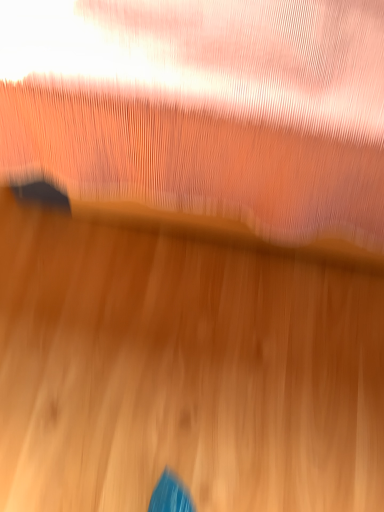
Question: Are pink sheer curtain at upper center and wooden floor at center located far from each other?

Choices:
 (A) no
 (B) yes

Answer: (A)

Question: Is the depth of pink sheer curtain at upper center greater than that of wooden floor at center?

Choices:
 (A) no
 (B) yes

Answer: (A)

Question: From the image's perspective, is pink sheer curtain at upper center located beneath wooden floor at center?

Choices:
 (A) no
 (B) yes

Answer: (A)

Question: Can you confirm if pink sheer curtain at upper center is smaller than wooden floor at center?

Choices:
 (A) yes
 (B) no

Answer: (B)

Question: From a real-world perspective, is pink sheer curtain at upper center below wooden floor at center?

Choices:
 (A) yes
 (B) no

Answer: (B)

Question: Considering the relative sizes of pink sheer curtain at upper center and wooden floor at center in the image provided, is pink sheer curtain at upper center thinner than wooden floor at center?

Choices:
 (A) no
 (B) yes

Answer: (A)

Question: Does wooden floor at center contain pink sheer curtain at upper center?

Choices:
 (A) no
 (B) yes

Answer: (A)

Question: Is wooden floor at center positioned behind pink sheer curtain at upper center?

Choices:
 (A) no
 (B) yes

Answer: (B)

Question: From the image's perspective, does wooden floor at center appear lower than pink sheer curtain at upper center?

Choices:
 (A) no
 (B) yes

Answer: (B)

Question: Is wooden floor at center at the right side of pink sheer curtain at upper center?

Choices:
 (A) no
 (B) yes

Answer: (A)

Question: Considering the relative sizes of wooden floor at center and pink sheer curtain at upper center in the image provided, is wooden floor at center thinner than pink sheer curtain at upper center?

Choices:
 (A) yes
 (B) no

Answer: (A)

Question: Can you confirm if wooden floor at center is positioned to the left of pink sheer curtain at upper center?

Choices:
 (A) no
 (B) yes

Answer: (B)

Question: Is point (150, 74) closer or farther from the camera than point (261, 369)?

Choices:
 (A) farther
 (B) closer

Answer: (B)